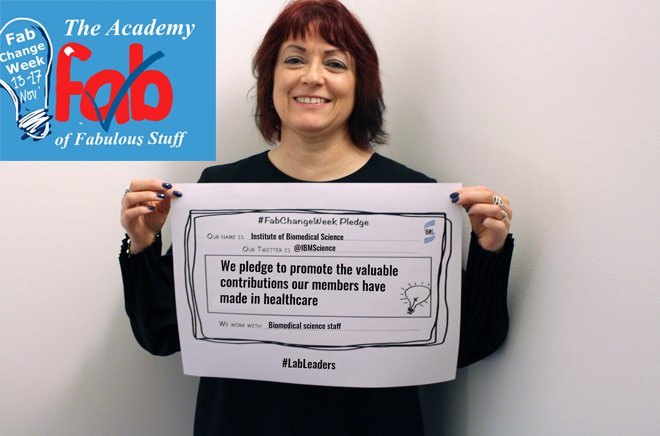
Image resolution: width=660 pixels, height=436 pixels. What are the coordinates of `white wall` in the screenshot? It's located at (478, 77).